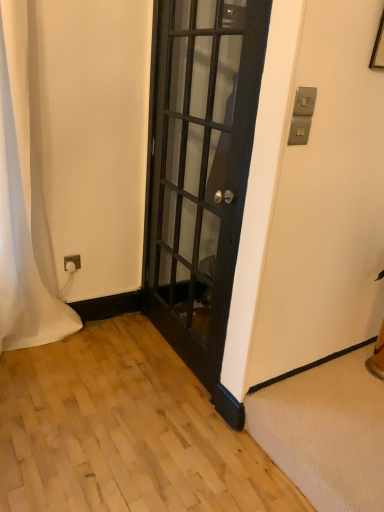
Question: From a real-world perspective, is white fabric curtain at left physically located above or below black glass door at center?

Choices:
 (A) above
 (B) below

Answer: (B)

Question: Is point (1, 268) positioned closer to the camera than point (157, 86)?

Choices:
 (A) closer
 (B) farther

Answer: (A)

Question: Is white fabric curtain at left to the left or to the right of black glass door at center in the image?

Choices:
 (A) right
 (B) left

Answer: (B)

Question: In the image, is black glass door at center positioned in front of or behind white fabric curtain at left?

Choices:
 (A) front
 (B) behind

Answer: (A)

Question: Is point (180, 265) closer or farther from the camera than point (6, 344)?

Choices:
 (A) closer
 (B) farther

Answer: (B)

Question: From their relative heights in the image, would you say black glass door at center is taller or shorter than white fabric curtain at left?

Choices:
 (A) short
 (B) tall

Answer: (B)

Question: Considering the positions of black glass door at center and white fabric curtain at left in the image, is black glass door at center wider or thinner than white fabric curtain at left?

Choices:
 (A) wide
 (B) thin

Answer: (B)